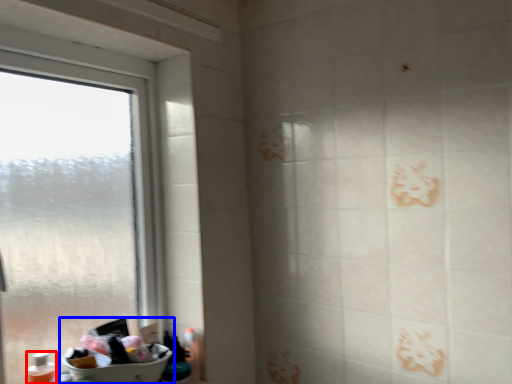
Question: Which object is further to the camera taking this photo, toiletry (highlighted by a red box) or sink (highlighted by a blue box)?

Choices:
 (A) toiletry
 (B) sink

Answer: (A)